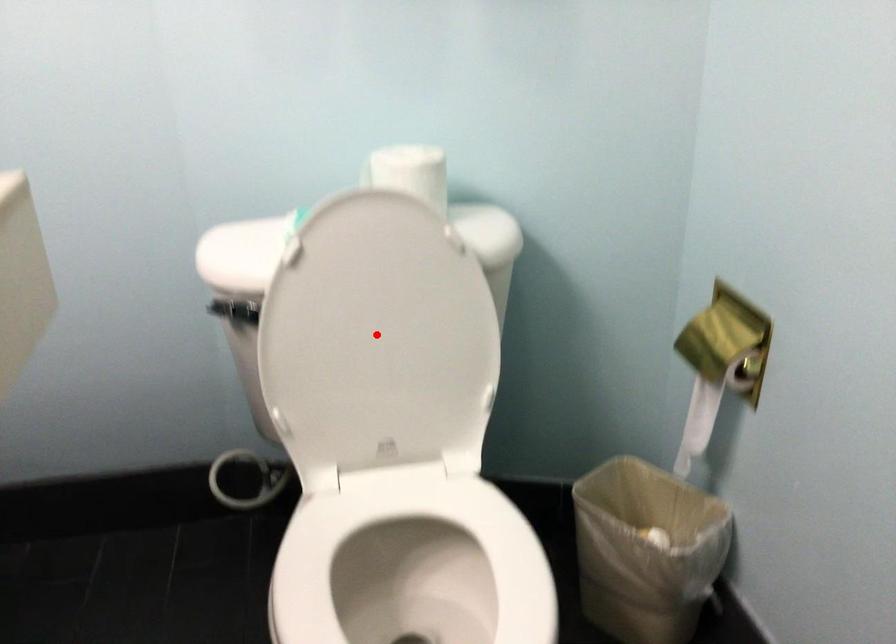
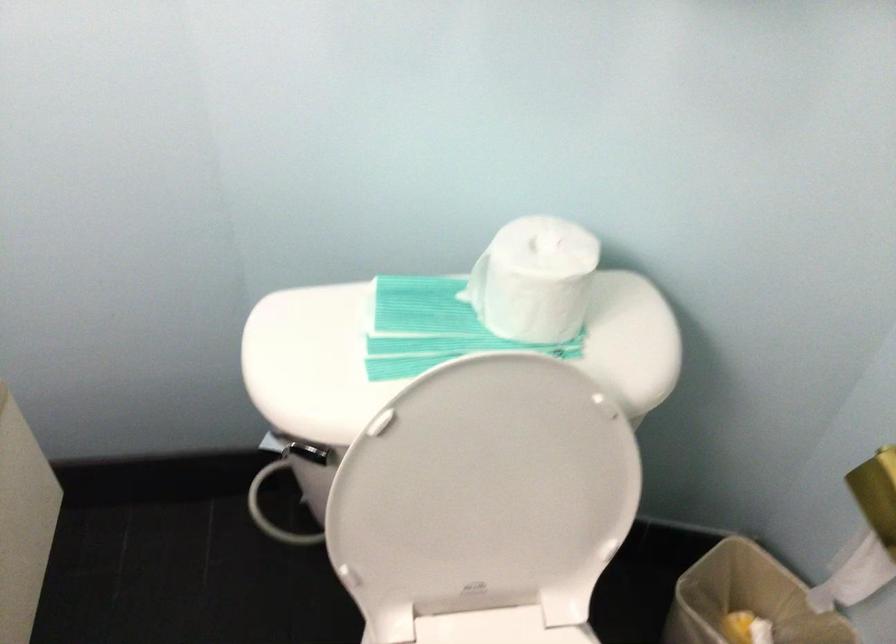
Find the pixel in the second image that matches the highlighted location in the first image.

(486, 496)